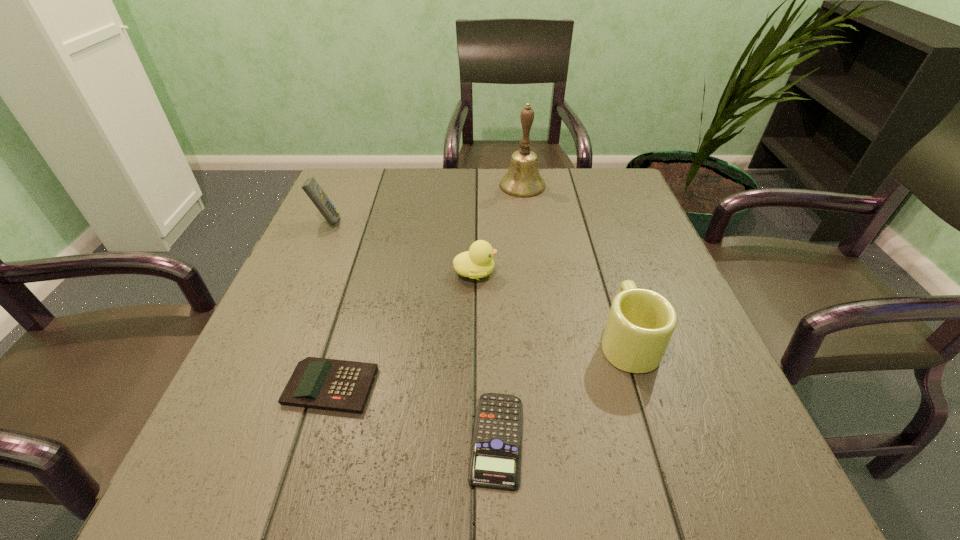
This screenshot has height=540, width=960. In order to click on vacant space that satisfies the following two spatial constraints: 1. with the handle on the side of the mug; 2. on the front-facing side of the tallest calculator in this screenshot , I will do `click(589, 221)`.

I want to click on free space that satisfies the following two spatial constraints: 1. on the front-facing side of the leftmost object; 2. with the handle on the side of the rightmost object, so click(274, 341).

Where is `free space in the image that satisfies the following two spatial constraints: 1. at the beak of the duckling; 2. on the front side of the second tallest calculator`? The width and height of the screenshot is (960, 540). free space in the image that satisfies the following two spatial constraints: 1. at the beak of the duckling; 2. on the front side of the second tallest calculator is located at coordinates click(x=473, y=387).